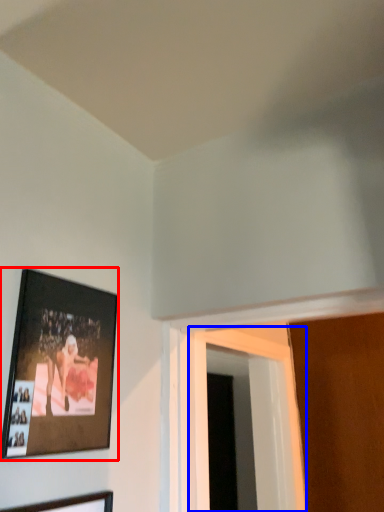
Question: Among these objects, which one is nearest to the camera, picture frame (highlighted by a red box) or window (highlighted by a blue box)?

Choices:
 (A) picture frame
 (B) window

Answer: (A)